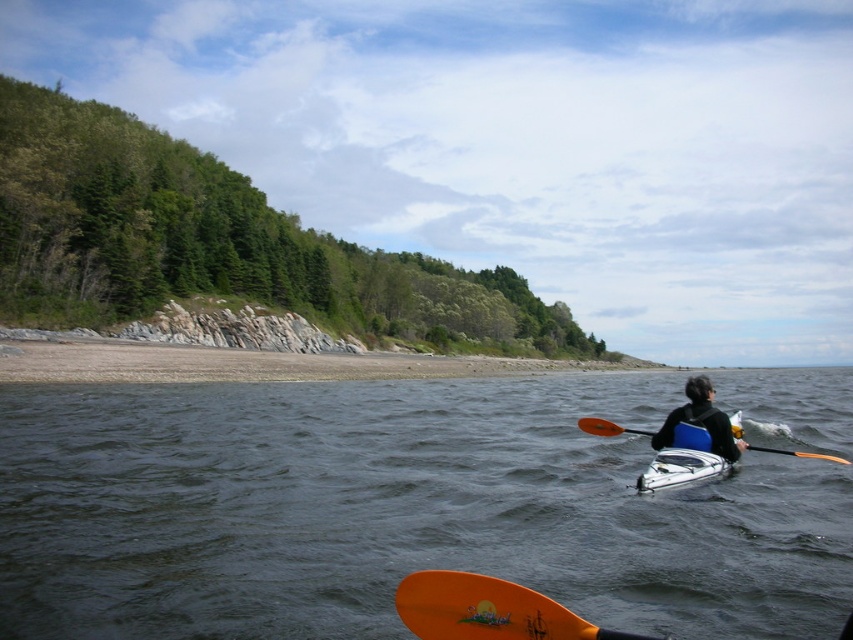
Question: Which of these objects is positioned farthest from the dark blue water at center?

Choices:
 (A) orange matte paddle at lower center
 (B) white glossy canoe at center
 (C) brown sand at lower left

Answer: (A)

Question: Which point is farther to the camera?

Choices:
 (A) orange matte paddle at lower center
 (B) blue plastic kayak at center
 (C) brown sand at lower left

Answer: (C)

Question: Can you confirm if white glossy canoe at center is positioned below orange paddle at right?

Choices:
 (A) no
 (B) yes

Answer: (A)

Question: Which point is closer to the camera taking this photo?

Choices:
 (A) (339, 358)
 (B) (700, 406)
 (C) (548, 627)

Answer: (C)

Question: Where is brown sand at lower left located in relation to blue plastic kayak at center in the image?

Choices:
 (A) below
 (B) above

Answer: (A)

Question: Does orange matte paddle at lower center have a larger size compared to orange paddle at right?

Choices:
 (A) no
 (B) yes

Answer: (B)